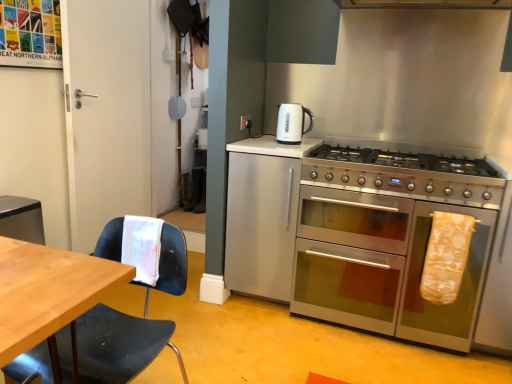
Where is `free space to the left of stainless steel oven at right`? free space to the left of stainless steel oven at right is located at coordinates pyautogui.click(x=264, y=331).